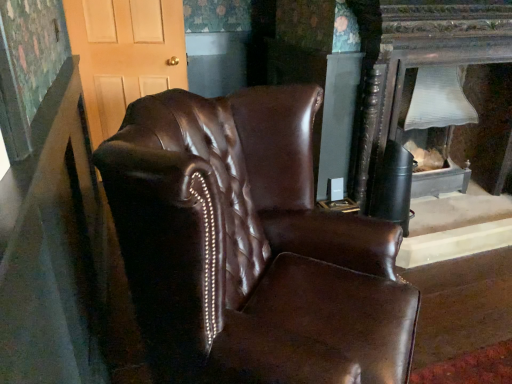
The height and width of the screenshot is (384, 512). Identify the location of matte wood door at upper left. (125, 54).

In order to face shiny brown leather armchair at center, should I rotate leftwards or rightwards?

You should rotate right by 3.892 degrees.

The height and width of the screenshot is (384, 512). What do you see at coordinates (434, 127) in the screenshot?
I see `matte white lampshade at right` at bounding box center [434, 127].

You are a GUI agent. You are given a task and a screenshot of the screen. Output one action in this format:
    pyautogui.click(x=<x>, y=<y>)
    Task: Click on the matte white lampshade at right
    
    Given the screenshot: What is the action you would take?
    pyautogui.click(x=434, y=127)

Identify the location of matte wood door at upper left. The width and height of the screenshot is (512, 384). (x=125, y=54).

Is shiny brown leather armchair at center at the right side of matte white lampshade at right?

In fact, shiny brown leather armchair at center is to the left of matte white lampshade at right.

Can you confirm if shiny brown leather armchair at center is smaller than matte white lampshade at right?

No.

This screenshot has width=512, height=384. In order to click on fireplace that is on the right side of shiny brown leather armchair at center in this screenshot , I will do pos(434,127).

Looking at this image, from their relative heights in the image, would you say shiny brown leather armchair at center is taller or shorter than matte white lampshade at right?

In the image, shiny brown leather armchair at center appears to be taller than matte white lampshade at right.

Can you confirm if matte wood door at upper left is thinner than matte white lampshade at right?

Correct, the width of matte wood door at upper left is less than that of matte white lampshade at right.

How distant is matte wood door at upper left from matte white lampshade at right?

1.75 meters.

Consider the image. Considering the relative positions of matte wood door at upper left and matte white lampshade at right in the image provided, is matte wood door at upper left behind matte white lampshade at right?

Yes, it is.

Who is taller, matte wood door at upper left or matte white lampshade at right?

matte wood door at upper left is taller.

Could you tell me if matte white lampshade at right is turned towards matte wood door at upper left?

No, matte white lampshade at right does not turn towards matte wood door at upper left.

From a real-world perspective, who is located lower, matte white lampshade at right or matte wood door at upper left?

From a 3D spatial view, matte white lampshade at right is below.

From the image's perspective, is matte white lampshade at right located beneath matte wood door at upper left?

Yes, from the image's perspective, matte white lampshade at right is below matte wood door at upper left.

How different are the orientations of matte white lampshade at right and matte wood door at upper left in degrees?

The angle between the facing direction of matte white lampshade at right and the facing direction of matte wood door at upper left is 22.1 degrees.

From the image's perspective, between matte wood door at upper left and shiny brown leather armchair at center, which one is located above?

matte wood door at upper left is shown above in the image.

I want to click on chair that appears on the right of matte wood door at upper left, so click(250, 247).

In the image, is matte wood door at upper left positioned in front of or behind shiny brown leather armchair at center?

Visually, matte wood door at upper left is located behind shiny brown leather armchair at center.

Is matte wood door at upper left next to shiny brown leather armchair at center and touching it?

They are not placed beside each other.

Is matte white lampshade at right oriented away from shiny brown leather armchair at center?

No, shiny brown leather armchair at center is not at the back of matte white lampshade at right.

In the scene shown: Is matte white lampshade at right touching shiny brown leather armchair at center?

matte white lampshade at right and shiny brown leather armchair at center are clearly separated.

This screenshot has width=512, height=384. What are the coordinates of `chair that is in front of the matte white lampshade at right` in the screenshot? It's located at (250, 247).

From a real-world perspective, between shiny brown leather armchair at center and matte wood door at upper left, who is vertically higher?

matte wood door at upper left, from a real-world perspective.

Is shiny brown leather armchair at center not close to matte wood door at upper left?

Yes, shiny brown leather armchair at center and matte wood door at upper left are quite far apart.

You are a GUI agent. You are given a task and a screenshot of the screen. Output one action in this format:
    pyautogui.click(x=<x>, y=<y>)
    Task: Click on the glass door above the shiny brown leather armchair at center (from a real-world perspective)
    The width and height of the screenshot is (512, 384).
    Given the screenshot: What is the action you would take?
    pyautogui.click(x=125, y=54)

Who is taller, shiny brown leather armchair at center or matte wood door at upper left?

Standing taller between the two is shiny brown leather armchair at center.

Locate an element on the screen. Image resolution: width=512 pixels, height=384 pixels. chair in front of the matte white lampshade at right is located at coordinates (250, 247).

What are the coordinates of `fireplace on the right of matte wood door at upper left` in the screenshot? It's located at (434, 127).

Estimate the real-world distances between objects in this image. Which object is further from shiny brown leather armchair at center, matte white lampshade at right or matte wood door at upper left?

The object further to shiny brown leather armchair at center is matte wood door at upper left.

Which object lies further to the anchor point shiny brown leather armchair at center, matte wood door at upper left or matte white lampshade at right?

matte wood door at upper left is further to shiny brown leather armchair at center.

Which object lies nearer to the anchor point matte white lampshade at right, shiny brown leather armchair at center or matte wood door at upper left?

shiny brown leather armchair at center is positioned closer to the anchor matte white lampshade at right.

Considering their positions, is shiny brown leather armchair at center positioned closer to matte wood door at upper left than matte white lampshade at right?

matte white lampshade at right lies closer to matte wood door at upper left than the other object.

Which object lies further to the anchor point matte white lampshade at right, matte wood door at upper left or shiny brown leather armchair at center?

matte wood door at upper left.

Based on the photo, looking at the image, which one is located further to matte wood door at upper left, matte white lampshade at right or shiny brown leather armchair at center?

shiny brown leather armchair at center is further to matte wood door at upper left.

I want to click on fireplace between shiny brown leather armchair at center and matte wood door at upper left along the z-axis, so click(434, 127).